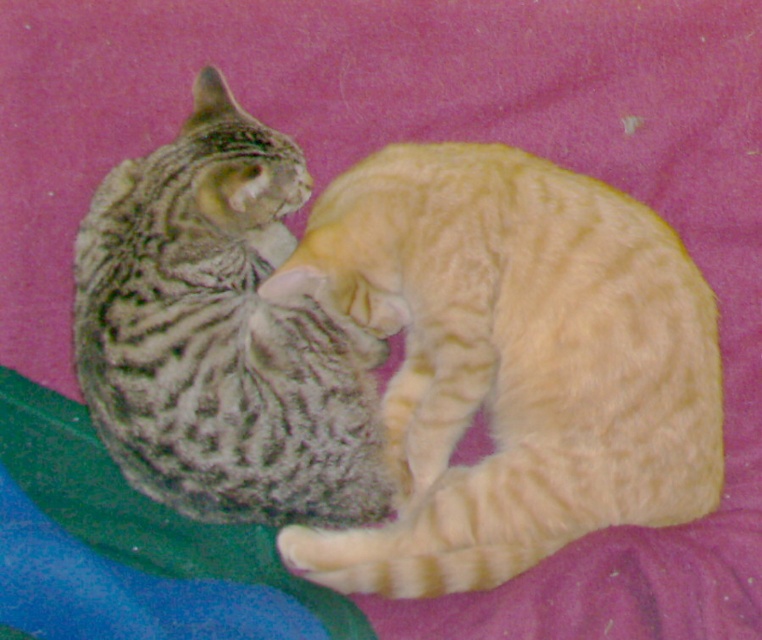
Question: Which object is farther from the camera taking this photo?

Choices:
 (A) orange tabby cat at center
 (B) gray striped cat at left

Answer: (B)

Question: Where is orange tabby cat at center located in relation to gray striped cat at left in the image?

Choices:
 (A) right
 (B) left

Answer: (A)

Question: Does orange tabby cat at center come in front of gray striped cat at left?

Choices:
 (A) yes
 (B) no

Answer: (A)

Question: Where is orange tabby cat at center located in relation to gray striped cat at left in the image?

Choices:
 (A) below
 (B) above

Answer: (A)

Question: Which of the following is the closest to the observer?

Choices:
 (A) (263, 253)
 (B) (520, 468)

Answer: (B)